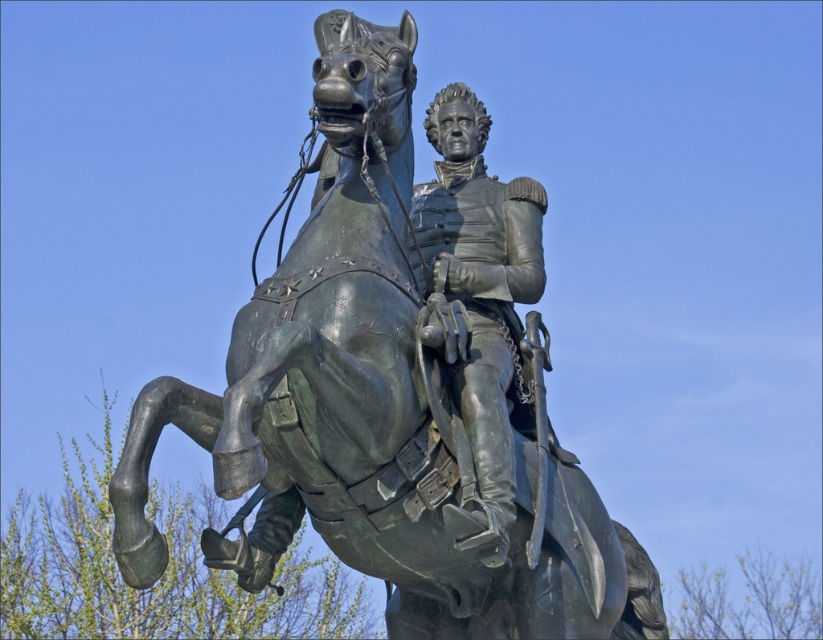
You are an art student analyzing the bronze equestrian statue. You notice the bronze statue at center and the shiny bronze uniform at center. Which object is larger in size?

The bronze statue at center is bigger than the shiny bronze uniform at center.

You are an art student analyzing the proportions of the bronze equestrian statue. Based on the image, does the bronze statue at center appear wider than the shiny bronze uniform at center?

The bronze statue at center is wider than the shiny bronze uniform at center, so yes, it appears wider.

You are an art student analyzing the proportions of the bronze statue and its rider. Based on the scene, which object is taller between the bronze statue at center and the shiny bronze uniform at center?

The bronze statue at center is taller than the shiny bronze uniform at center.